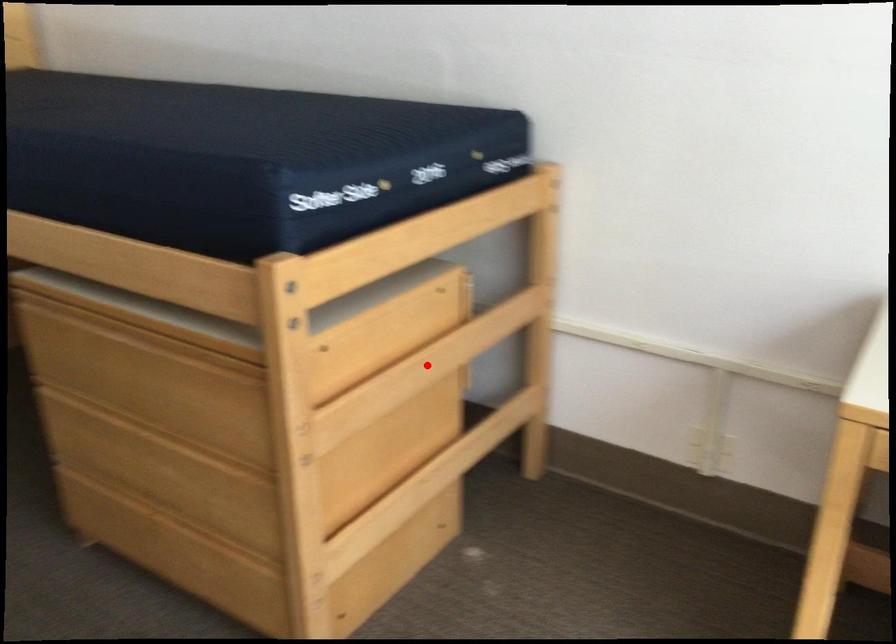
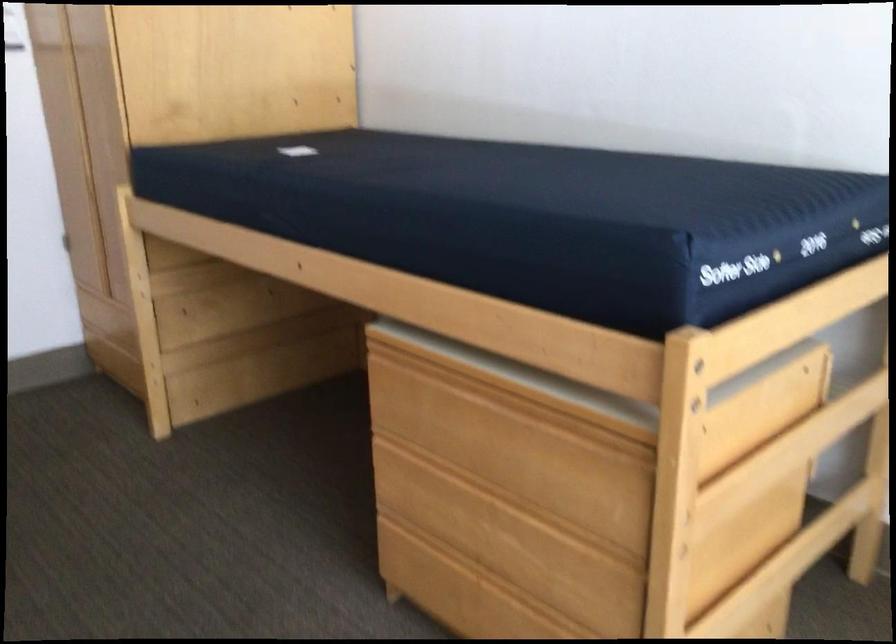
Where in the second image is the point corresponding to the highlighted location from the first image?

(789, 451)